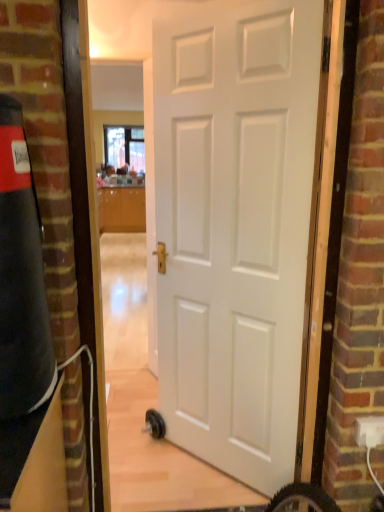
Where is `vacant space underneath white matte door at center (from a real-world perspective)`? The width and height of the screenshot is (384, 512). vacant space underneath white matte door at center (from a real-world perspective) is located at coordinates (210, 472).